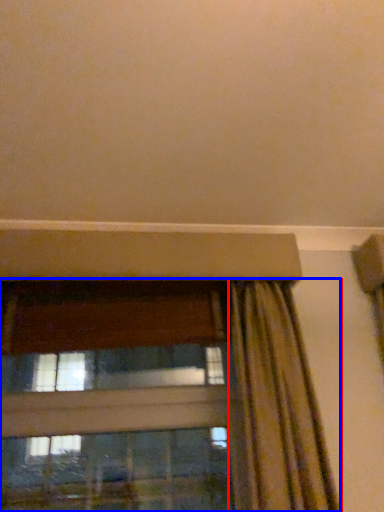
Question: Which object is closer to the camera taking this photo, curtain (highlighted by a red box) or window (highlighted by a blue box)?

Choices:
 (A) curtain
 (B) window

Answer: (A)